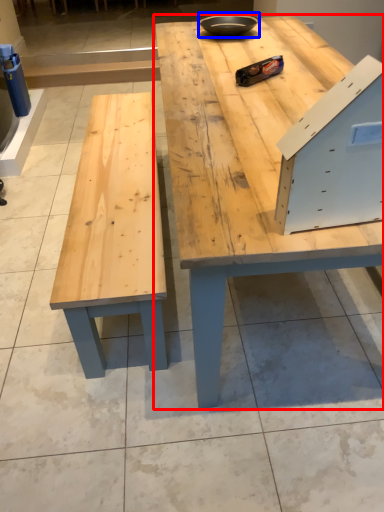
Question: Which object is closer to the camera taking this photo, table (highlighted by a red box) or bowl (highlighted by a blue box)?

Choices:
 (A) table
 (B) bowl

Answer: (A)